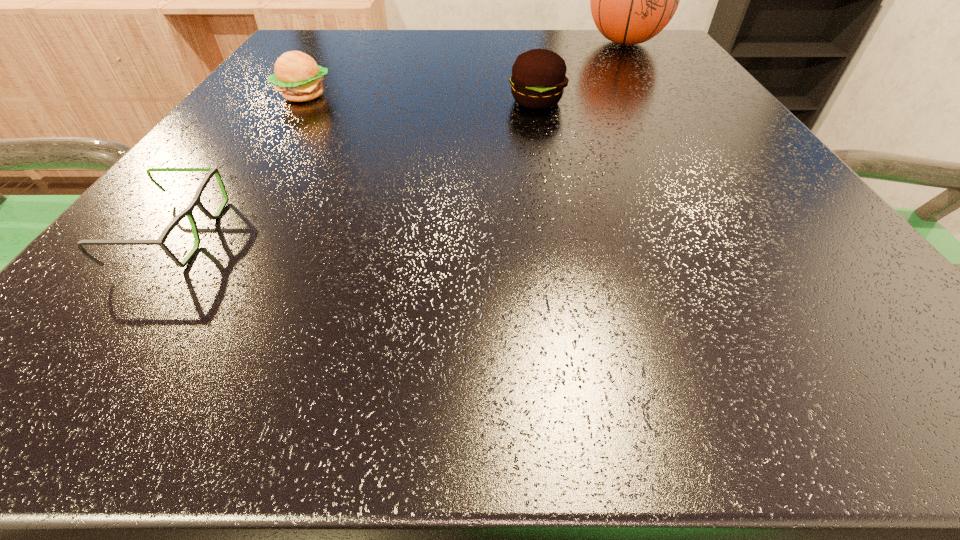
Find the location of `object positioned at the far edge`. object positioned at the far edge is located at coordinates (632, 0).

You are a GUI agent. You are given a task and a screenshot of the screen. Output one action in this format:
    pyautogui.click(x=<x>, y=<y>)
    Task: Click on the hamburger that is positioned at the left edge
    
    Given the screenshot: What is the action you would take?
    pyautogui.click(x=298, y=77)

Identify the location of spectacles that is at the left edge. pyautogui.click(x=196, y=201).

Locate an element on the screen. The height and width of the screenshot is (540, 960). object that is at the right edge is located at coordinates (632, 0).

Locate an element on the screen. object present at the far right corner is located at coordinates (632, 0).

Locate an element on the screen. vacant position at the far edge of the desktop is located at coordinates pyautogui.click(x=519, y=49).

What are the coordinates of `vacant space at the near edge` in the screenshot? It's located at (511, 322).

You are a GUI agent. You are given a task and a screenshot of the screen. Output one action in this format:
    pyautogui.click(x=<x>, y=<y>)
    Task: Click on the blank space at the left edge of the desktop
    The width and height of the screenshot is (960, 540).
    Given the screenshot: What is the action you would take?
    pyautogui.click(x=161, y=228)

This screenshot has height=540, width=960. In order to click on vacant space at the right edge of the desktop in this screenshot , I will do `click(671, 93)`.

In the image, there is a desktop. Where is `vacant space at the far left corner`? vacant space at the far left corner is located at coordinates (317, 31).